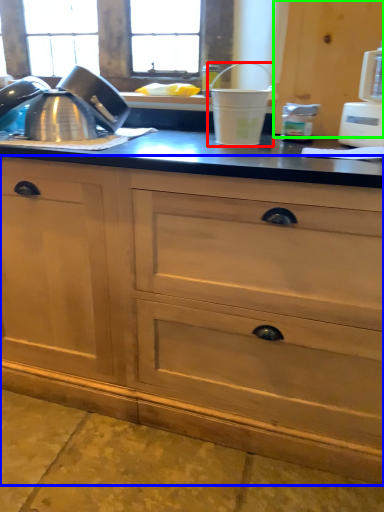
Question: Which is nearer to the appliance (highlighted by a red box)? cabinetry (highlighted by a blue box) or cabinetry (highlighted by a green box).

Choices:
 (A) cabinetry
 (B) cabinetry

Answer: (B)